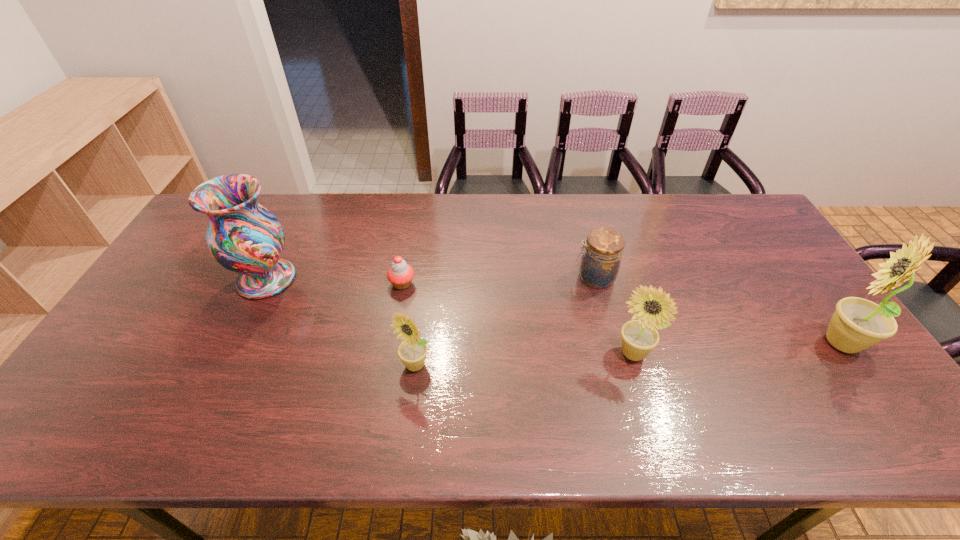
Where is `vacant place for an extra sunflower on the left`? vacant place for an extra sunflower on the left is located at coordinates (187, 377).